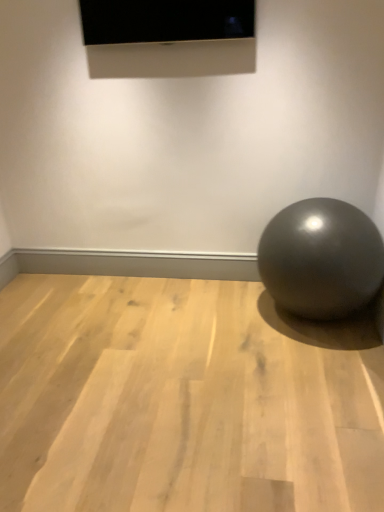
Locate an element on the screen. vacant space in front of glossy metallic ball at lower right is located at coordinates (317, 373).